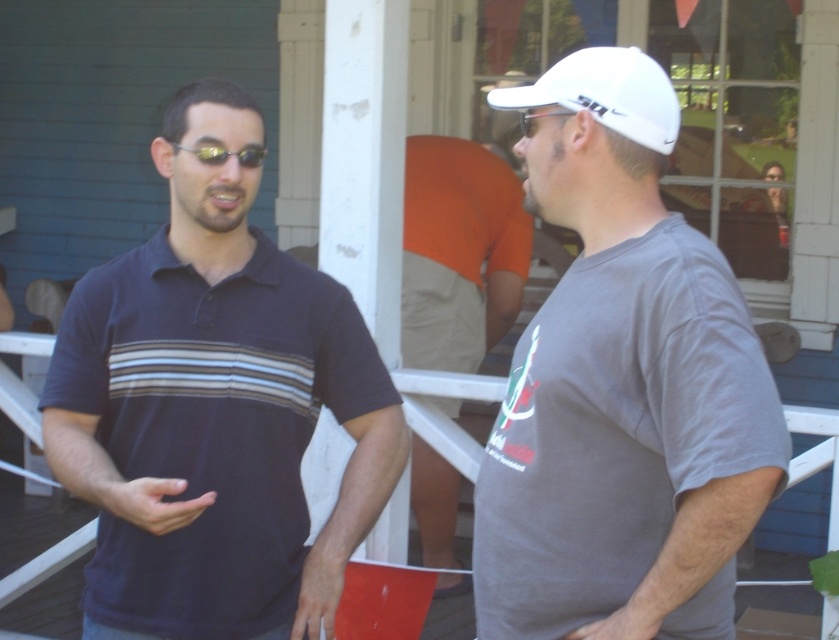
Question: Which object is positioned closest to the white matte baseball cap at upper right?

Choices:
 (A) navy blue polo shirt at left
 (B) orange cotton shirt at center
 (C) shiny black sunglasses at center

Answer: (C)

Question: Does white matte baseball cap at upper right have a greater width compared to clear plastic goggles at center?

Choices:
 (A) no
 (B) yes

Answer: (B)

Question: Which point is closer to the camera?

Choices:
 (A) navy blue polo shirt at left
 (B) white matte baseball cap at upper right

Answer: (A)

Question: Can you confirm if navy blue polo shirt at left is bigger than white matte baseball cap at upper right?

Choices:
 (A) yes
 (B) no

Answer: (A)

Question: Does white matte baseball cap at upper right appear over shiny black sunglasses at center?

Choices:
 (A) yes
 (B) no

Answer: (A)

Question: Among these points, which one is farthest from the camera?

Choices:
 (A) (678, 108)
 (B) (582, 58)
 (C) (181, 368)

Answer: (C)